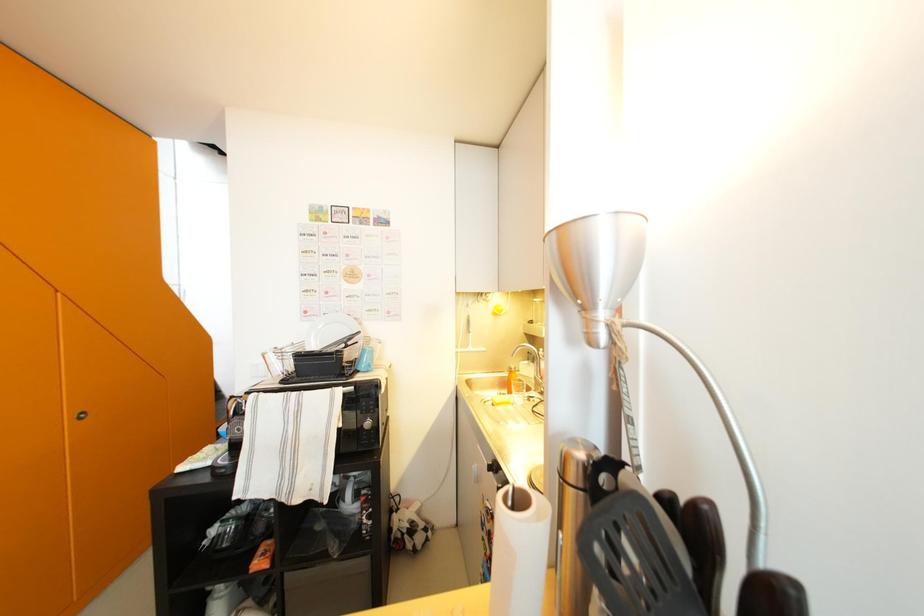
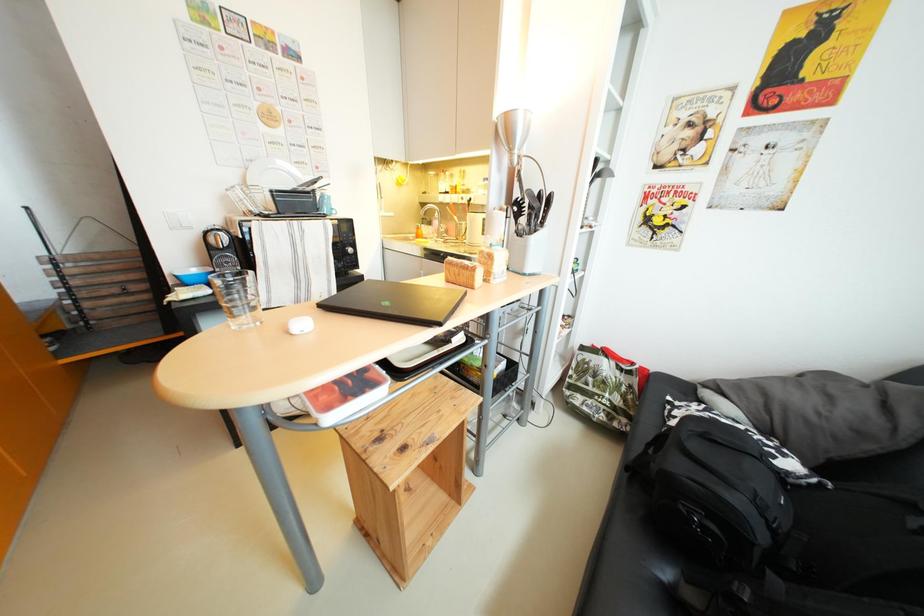
How did the camera likely rotate?

The rotation direction of the camera is right-down.